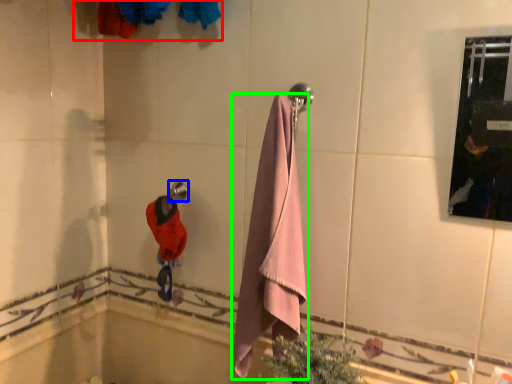
Question: Which object is positioned farthest from laundry (highlighted by a red box)? Select from towel bar (highlighted by a blue box) and towel (highlighted by a green box).

Choices:
 (A) towel bar
 (B) towel

Answer: (B)